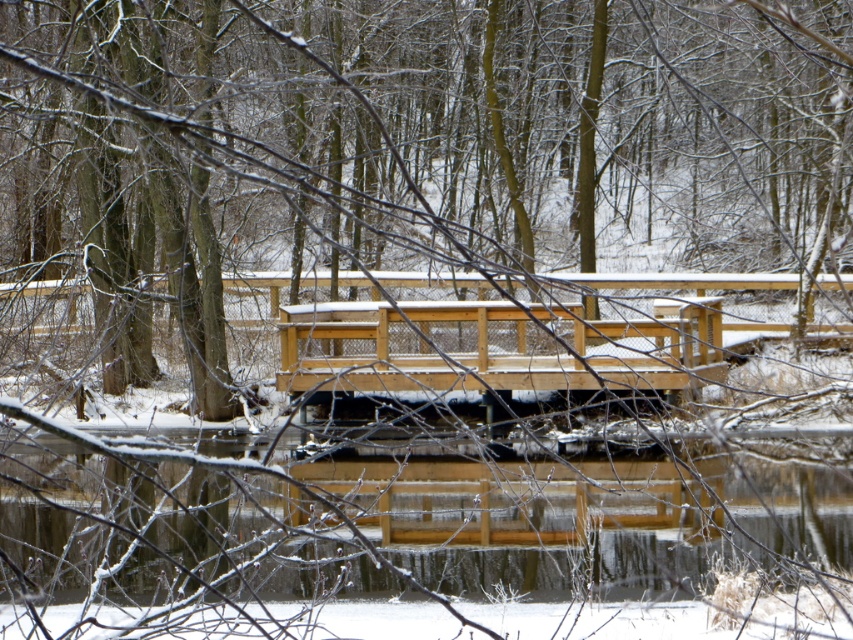
Question: Considering the relative positions of clear water at center and natural wood bridge at center in the image provided, where is clear water at center located with respect to natural wood bridge at center?

Choices:
 (A) right
 (B) left

Answer: (B)

Question: Which point appears farthest from the camera in this image?

Choices:
 (A) 784,506
 (B) 405,355

Answer: (B)

Question: Does clear water at center appear under natural wood bridge at center?

Choices:
 (A) yes
 (B) no

Answer: (A)

Question: Which object is closer to the camera taking this photo?

Choices:
 (A) clear water at center
 (B) natural wood bridge at center

Answer: (A)

Question: Can you confirm if clear water at center is thinner than natural wood bridge at center?

Choices:
 (A) yes
 (B) no

Answer: (B)